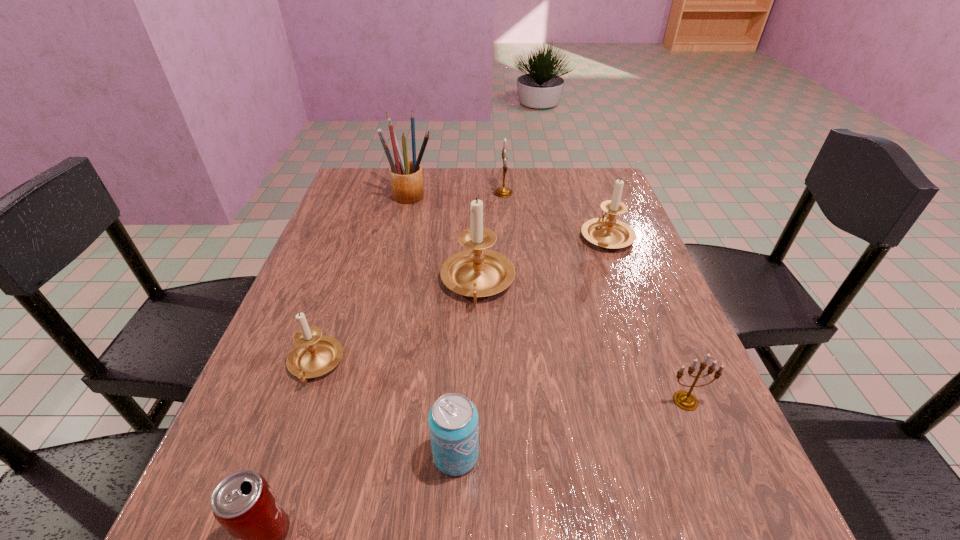
In the image, there is a desktop. At what (x,y) coordinates should I click in order to perform the action: click on vacant area at the far left corner. Please return your answer as a coordinate pair (x, y). This screenshot has height=540, width=960. Looking at the image, I should click on (346, 189).

In the image, there is a desktop. At what (x,y) coordinates should I click in order to perform the action: click on vacant region at the far right corner. Please return your answer as a coordinate pair (x, y). This screenshot has height=540, width=960. Looking at the image, I should click on (575, 193).

Image resolution: width=960 pixels, height=540 pixels. In order to click on free space that is in between the nearer gold candelabrum and the brown pencil box in this screenshot , I will do `click(548, 298)`.

In order to click on free space between the fifth nearest object and the seventh farthest object in this screenshot , I will do `click(467, 369)`.

Identify the location of blank region between the leftmost candelabrum and the brown pencil box. click(363, 280).

Where is `vacant space in between the right beer can and the brown pencil box`? Image resolution: width=960 pixels, height=540 pixels. vacant space in between the right beer can and the brown pencil box is located at coordinates (434, 325).

Where is `vacant area that lies between the smallest beige candle holder and the bigger gold candelabrum`? Image resolution: width=960 pixels, height=540 pixels. vacant area that lies between the smallest beige candle holder and the bigger gold candelabrum is located at coordinates (409, 279).

Locate an element on the screen. The height and width of the screenshot is (540, 960). the sixth closest object relative to the sixth nearest object is located at coordinates (x=314, y=355).

Locate an element on the screen. The height and width of the screenshot is (540, 960). object identified as the second closest to the second nearest beige candle holder is located at coordinates (314, 355).

I want to click on the closest candelabrum relative to the right gold candelabrum, so click(476, 272).